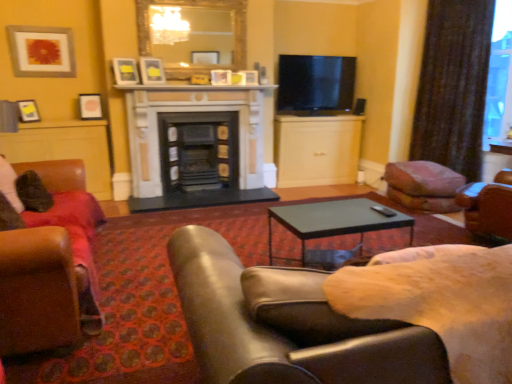
Find the location of a particular element. This screenshot has width=512, height=384. vacant point above matte black coffee table at center (from a real-world perspective) is located at coordinates (338, 206).